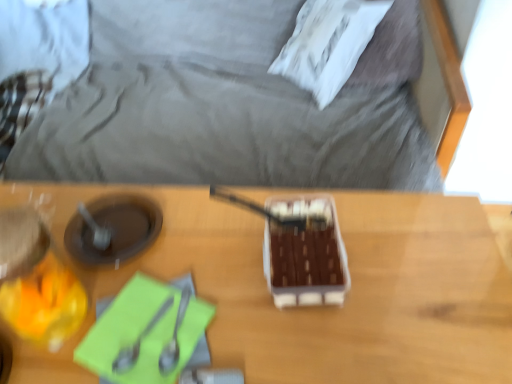
Image resolution: width=512 pixels, height=384 pixels. Find the location of `vacant area that is situated to the right of brown matte chocolate bar at center`. vacant area that is situated to the right of brown matte chocolate bar at center is located at coordinates (403, 253).